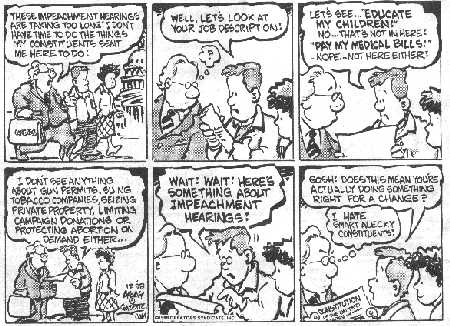
The image size is (450, 326). I want to click on newspaper, so click(x=219, y=125), click(x=367, y=148), click(x=347, y=308), click(x=208, y=309).